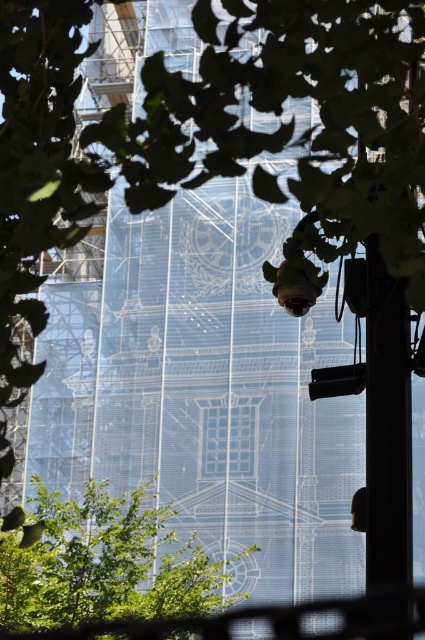
Looking at this image, which of these two, green leafy tree at center or black matte pole at right, stands shorter?

Standing shorter between the two is green leafy tree at center.

Is green leafy tree at center above black matte pole at right?

Actually, green leafy tree at center is below black matte pole at right.

Does point (28, 554) come in front of point (379, 541)?

That is False.

This screenshot has height=640, width=425. What are the coordinates of `green leafy tree at center` in the screenshot? It's located at (102, 564).